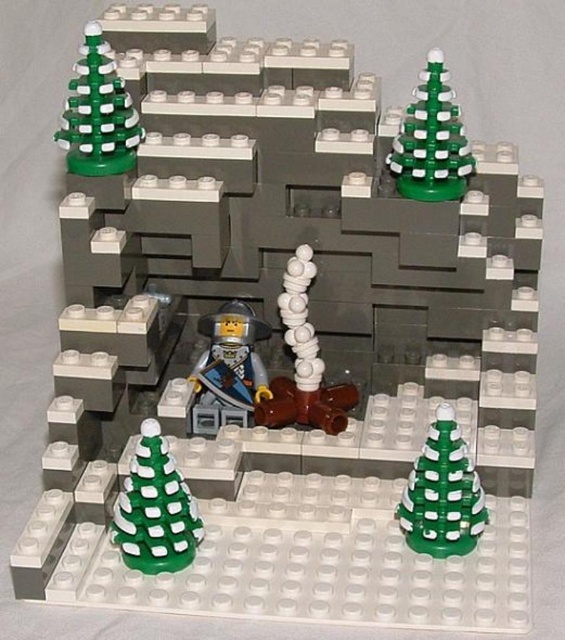
Question: Which point is farther from the camera taking this photo?

Choices:
 (A) (415, 500)
 (B) (245, 422)
 (C) (93, 115)

Answer: (B)

Question: Can you confirm if green matte christmas tree at lower left is bigger than white matte pipe at center?

Choices:
 (A) no
 (B) yes

Answer: (A)

Question: Does green matte christmas tree at lower right lie behind green matte christmas tree at upper right?

Choices:
 (A) no
 (B) yes

Answer: (A)

Question: Among these points, which one is nearest to the camera?

Choices:
 (A) (442, 195)
 (B) (440, 483)
 (C) (129, 122)

Answer: (B)

Question: Is white matte pipe at center behind metallic silver minifigure at center?

Choices:
 (A) yes
 (B) no

Answer: (B)

Question: Which of the following is the closest to the observer?

Choices:
 (A) (162, 472)
 (B) (293, 410)
 (C) (484, 506)

Answer: (A)